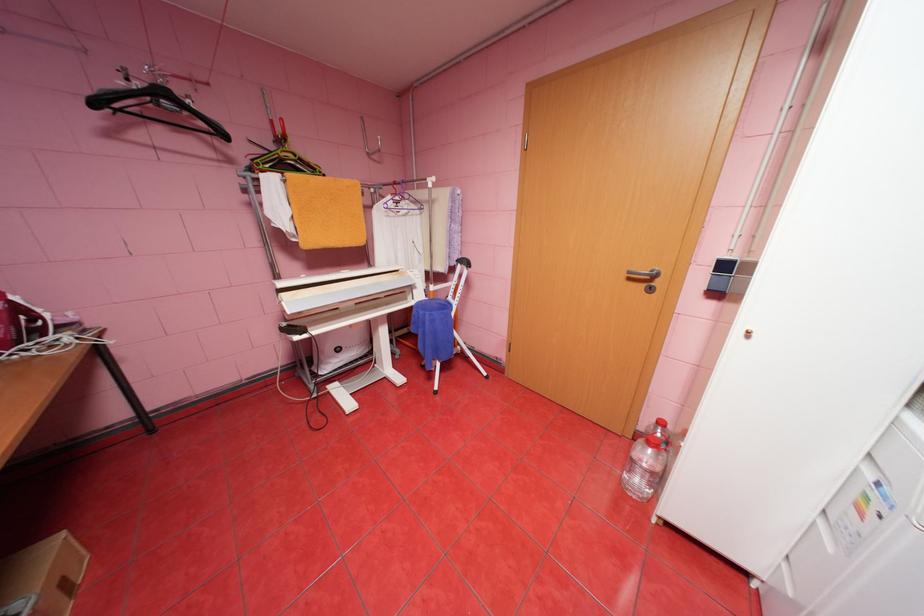
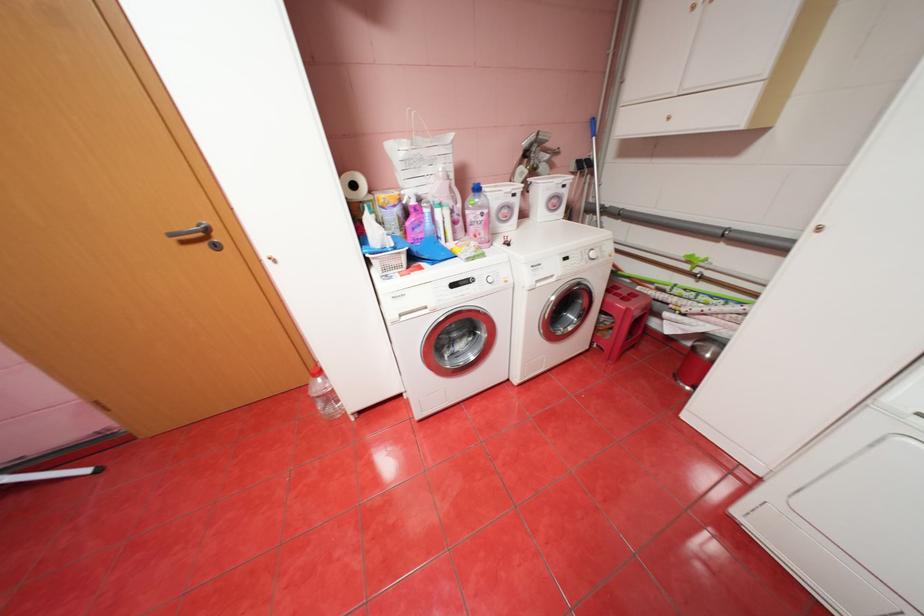
Where in the second image is the point corresponding to point (650, 285) from the first image?

(213, 245)